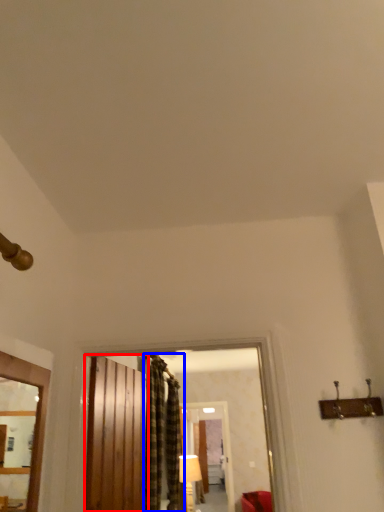
Question: Which object is further to the camera taking this photo, barn door (highlighted by a red box) or curtain (highlighted by a blue box)?

Choices:
 (A) barn door
 (B) curtain

Answer: (B)